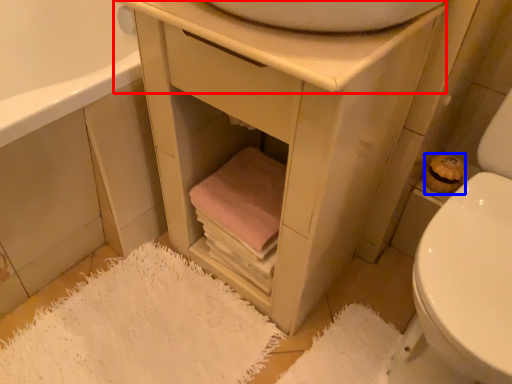
Question: Which object is closer to the camera taking this photo, counter top (highlighted by a red box) or toilet paper (highlighted by a blue box)?

Choices:
 (A) counter top
 (B) toilet paper

Answer: (A)